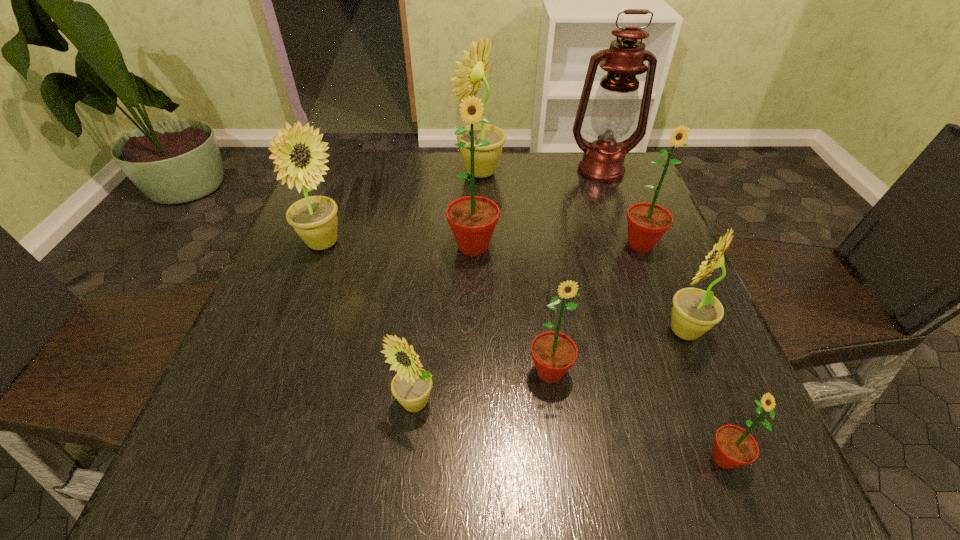
Find the location of a particular element. This screenshot has height=540, width=960. free space located on the face of the leftmost sunflower is located at coordinates tap(373, 244).

This screenshot has width=960, height=540. Identify the location of vacant space located on the face of the second biggest green sunflower. (658, 287).

The image size is (960, 540). Identify the location of vacant space located on the face of the rightmost yellow sunflower. (562, 330).

I want to click on blank space located on the face of the rightmost yellow sunflower, so click(583, 330).

Identify the location of vacant space located 0.060m on the face of the rightmost yellow sunflower. (629, 330).

The image size is (960, 540). Identify the location of vacant point located on the face of the fifth object from right to left. (556, 419).

Where is `vacant area situated 0.140m on the face of the nearest object`? The width and height of the screenshot is (960, 540). vacant area situated 0.140m on the face of the nearest object is located at coordinates pyautogui.click(x=613, y=458).

Identify the location of free space located on the face of the nearest object. 620,458.

Find the location of `free region located on the face of the nearest object`. free region located on the face of the nearest object is located at coordinates click(x=528, y=458).

Image resolution: width=960 pixels, height=540 pixels. In order to click on oil lamp present at the far edge in this screenshot , I will do 615,104.